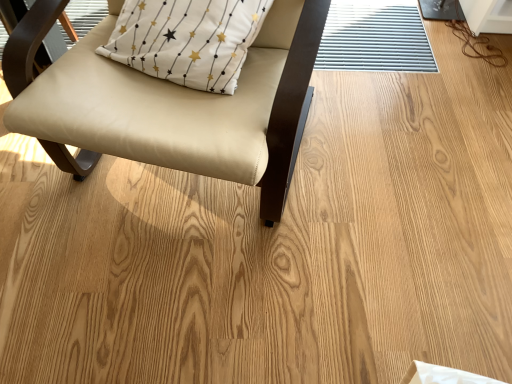
The height and width of the screenshot is (384, 512). Describe the element at coordinates (187, 40) in the screenshot. I see `white fabric pillow at upper left` at that location.

Locate an element on the screen. white fabric pillow at upper left is located at coordinates pos(187,40).

Where is `beige leather chair at upper left`? The image size is (512, 384). beige leather chair at upper left is located at coordinates tap(170, 103).

The image size is (512, 384). Describe the element at coordinates (170, 103) in the screenshot. I see `beige leather chair at upper left` at that location.

Where is `white fabric pillow at upper left`? This screenshot has height=384, width=512. white fabric pillow at upper left is located at coordinates (187, 40).

Does white fabric pillow at upper left appear on the right side of beige leather chair at upper left?

Correct, you'll find white fabric pillow at upper left to the right of beige leather chair at upper left.

Which object is more forward, white fabric pillow at upper left or beige leather chair at upper left?

beige leather chair at upper left is closer to the camera.

Does point (161, 54) come closer to viewer compared to point (95, 134)?

No, (161, 54) is behind (95, 134).

From the image's perspective, relative to beige leather chair at upper left, is white fabric pillow at upper left above or below?

white fabric pillow at upper left is situated higher than beige leather chair at upper left in the image.

From a real-world perspective, which is physically below, white fabric pillow at upper left or beige leather chair at upper left?

beige leather chair at upper left is physically lower.

Which of these two, white fabric pillow at upper left or beige leather chair at upper left, is thinner?

white fabric pillow at upper left.

Can you confirm if white fabric pillow at upper left is shorter than beige leather chair at upper left?

Yes, white fabric pillow at upper left is shorter than beige leather chair at upper left.

Between white fabric pillow at upper left and beige leather chair at upper left, which one has smaller size?

With smaller size is white fabric pillow at upper left.

Is beige leather chair at upper left surrounded by white fabric pillow at upper left?

No, beige leather chair at upper left is not inside white fabric pillow at upper left.

Is white fabric pillow at upper left far away from beige leather chair at upper left?

No, there isn't a large distance between white fabric pillow at upper left and beige leather chair at upper left.

From the picture: Could you tell me if white fabric pillow at upper left is turned towards beige leather chair at upper left?

Yes, white fabric pillow at upper left is oriented towards beige leather chair at upper left.

Can you tell me how much white fabric pillow at upper left and beige leather chair at upper left differ in facing direction?

There is a 8-degree angle between the facing directions of white fabric pillow at upper left and beige leather chair at upper left.

Image resolution: width=512 pixels, height=384 pixels. I want to click on chair below the white fabric pillow at upper left (from the image's perspective), so click(170, 103).

Does beige leather chair at upper left appear on the right side of white fabric pillow at upper left?

In fact, beige leather chair at upper left is to the left of white fabric pillow at upper left.

Which object is further away from the camera taking this photo, beige leather chair at upper left or white fabric pillow at upper left?

white fabric pillow at upper left is further away from the camera.

Which point is more distant from viewer, (250, 96) or (180, 53)?

The point (180, 53) is more distant.

From the image's perspective, relative to white fabric pillow at upper left, is beige leather chair at upper left above or below?

Clearly, from the image's perspective, beige leather chair at upper left is below white fabric pillow at upper left.

From a real-world perspective, is beige leather chair at upper left on white fabric pillow at upper left?

Actually, beige leather chair at upper left is physically below white fabric pillow at upper left in the real world.

Between beige leather chair at upper left and white fabric pillow at upper left, which one has smaller width?

With smaller width is white fabric pillow at upper left.

Which of these two, beige leather chair at upper left or white fabric pillow at upper left, stands shorter?

white fabric pillow at upper left is shorter.

Consider the image. Which of these two, beige leather chair at upper left or white fabric pillow at upper left, is smaller?

With smaller size is white fabric pillow at upper left.

Would you say beige leather chair at upper left is inside or outside white fabric pillow at upper left?

beige leather chair at upper left is not enclosed by white fabric pillow at upper left.

Is beige leather chair at upper left positioned far away from white fabric pillow at upper left?

Actually, beige leather chair at upper left and white fabric pillow at upper left are a little close together.

Is beige leather chair at upper left facing away from white fabric pillow at upper left?

Yes, beige leather chair at upper left is positioned with its back facing white fabric pillow at upper left.

Find the location of `chair to the left of white fabric pillow at upper left`. chair to the left of white fabric pillow at upper left is located at coordinates (170, 103).

At what (x,y) coordinates should I click in order to perform the action: click on pillow above the beige leather chair at upper left (from a real-world perspective). Please return your answer as a coordinate pair (x, y). This screenshot has width=512, height=384. Looking at the image, I should click on (x=187, y=40).

At what (x,y) coordinates should I click in order to perform the action: click on pillow that is behind the beige leather chair at upper left. Please return your answer as a coordinate pair (x, y). Image resolution: width=512 pixels, height=384 pixels. Looking at the image, I should click on (187, 40).